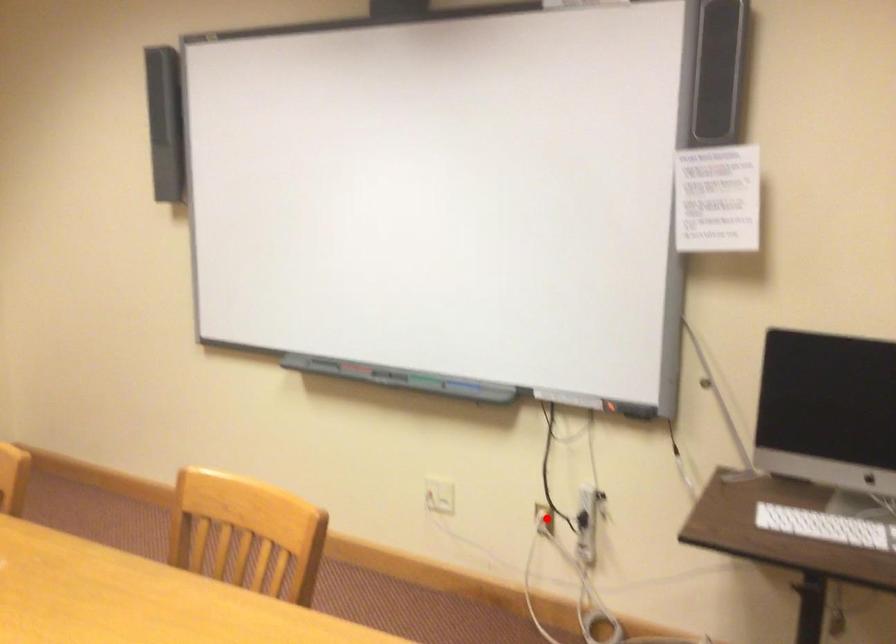
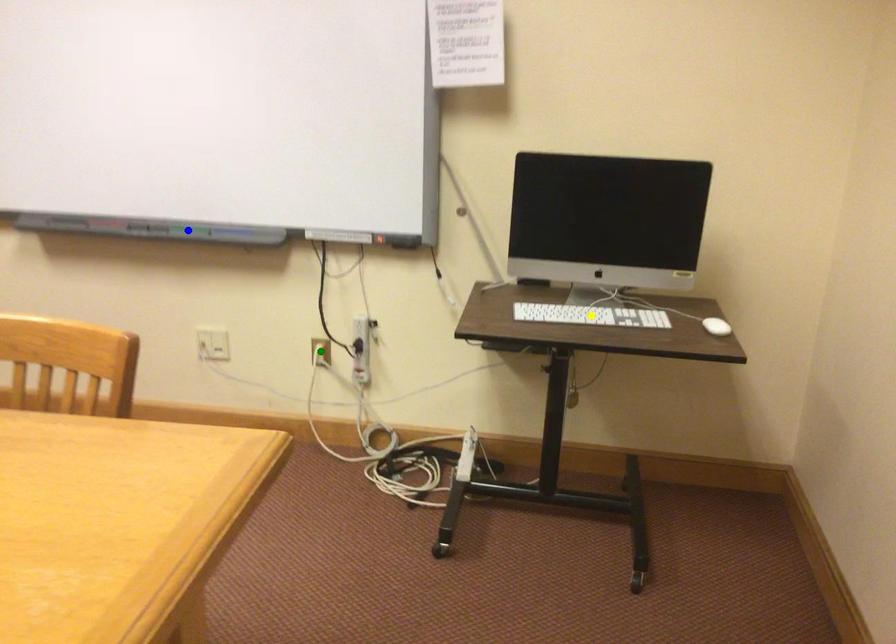
Question: I am providing you with two images of the same scene from different viewpoints. A red point is marked on the first image. You are given multiple points on the second image. Which point in image 2 is actually the same real-world point as the red point in image 1?

Choices:
 (A) blue point
 (B) yellow point
 (C) green point

Answer: (C)